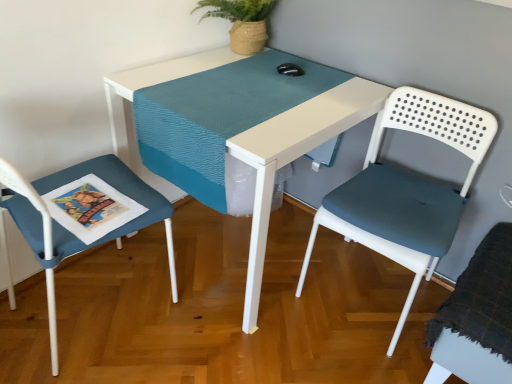
Question: From their relative heights in the image, would you say white plastic table at center is taller or shorter than white plastic chair at right, which appears as the second chair when viewed from the right?

Choices:
 (A) tall
 (B) short

Answer: (B)

Question: From a real-world perspective, is white plastic table at center physically located above or below white plastic chair at right, which appears as the 2th chair when viewed from the left?

Choices:
 (A) above
 (B) below

Answer: (B)

Question: Which of these objects is positioned closest to the white plastic chair at right, which appears as the second chair when viewed from the right?

Choices:
 (A) textured gray cushion at right, marked as the third chair in a left-to-right arrangement
 (B) textured blue cushion at left, arranged as the 1th chair when viewed from the left
 (C) white plastic table at center
 (D) teal woven runner at center

Answer: (C)

Question: Which of these objects is positioned closest to the textured blue cushion at left, arranged as the 1th chair when viewed from the left?

Choices:
 (A) textured gray cushion at right, marked as the third chair in a left-to-right arrangement
 (B) white plastic table at center
 (C) white plastic chair at right, which appears as the 2th chair when viewed from the left
 (D) teal woven runner at center

Answer: (D)